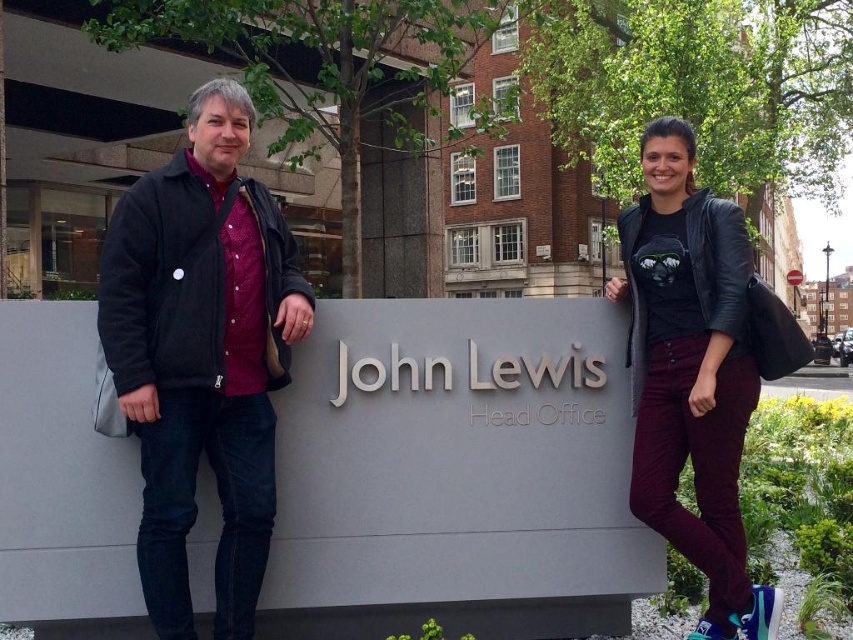
You are a photographer adjusting your camera settings to capture the scene in front of the John Lewis Head Office. You need to focus on the matte black jacket at left. What is the exact coordinate where you should aim your camera?

The exact coordinate to aim your camera is at point (196,355) where the matte black jacket at left is located.